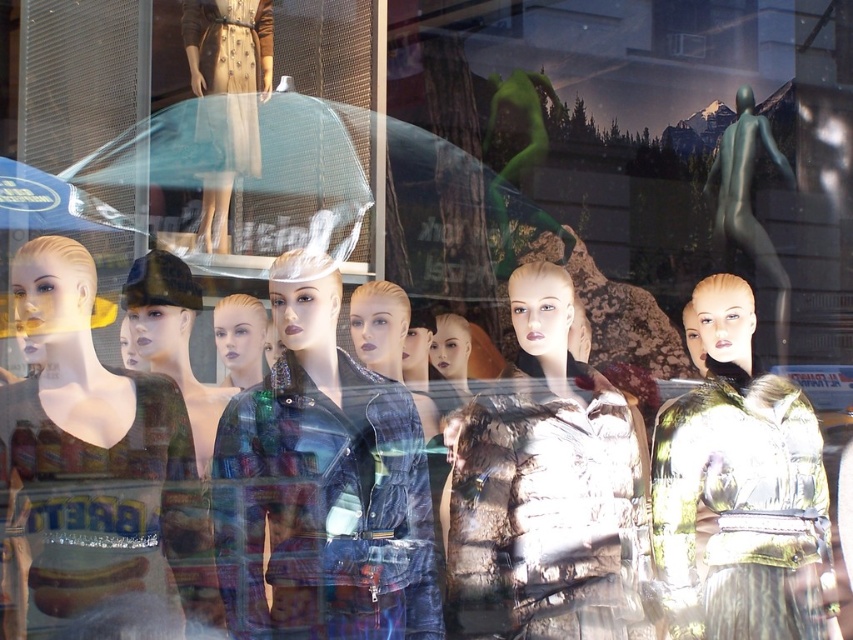
In the scene shown: You are a customer standing in front of the window display. You see the plaid fabric jacket at center and the matte black dress at left. Which item is positioned to the right of the other?

The plaid fabric jacket at center is to the right of the matte black dress at left.

From the picture: You are a customer in a store looking at the window display. You see the matte black dress at left and the metallic silver mannequin at upper right. Which one is positioned more to the left side of the display?

The matte black dress at left is positioned more to the left side of the display than the metallic silver mannequin at upper right.

You are a customer trying to decide between purchasing the matte black dress at left and the metallic silver mannequin at upper right. Which item is smaller in size?

The matte black dress at left has a smaller size compared to the metallic silver mannequin at upper right.